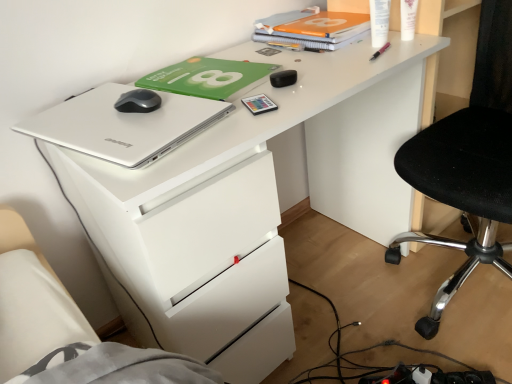
I want to click on free space in front of black matte earbuds at center, the fourth stationery viewed from the top, so click(x=269, y=106).